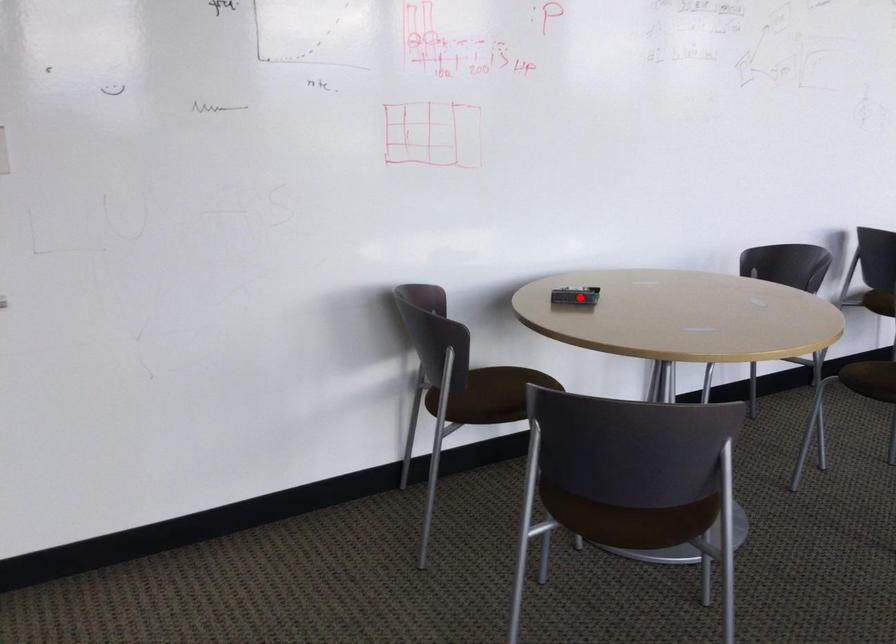
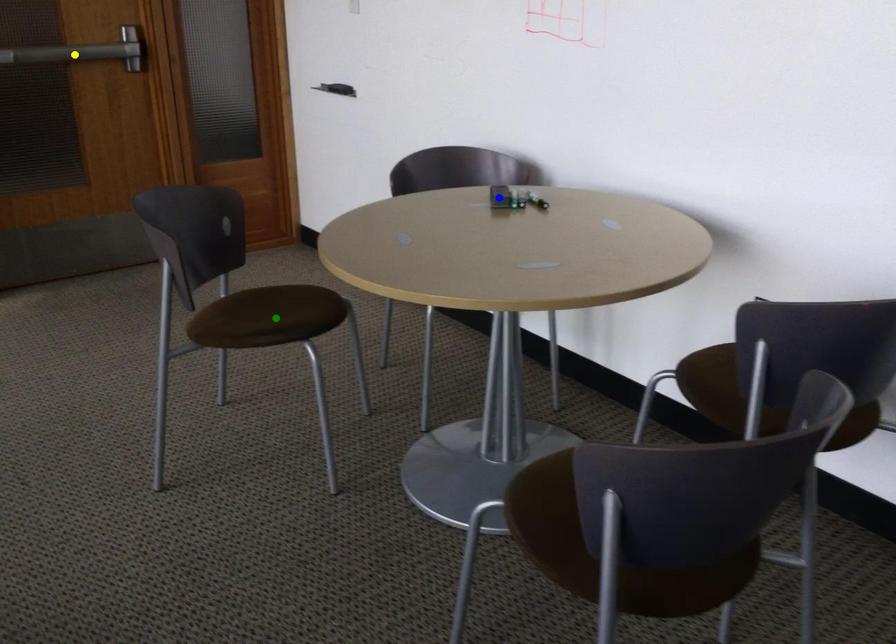
Question: I am providing you with two images of the same scene from different viewpoints. A red point is marked on the first image. You are given multiple points on the second image. Which spot in image 2 lines up with the point in image 1?

Choices:
 (A) green point
 (B) yellow point
 (C) blue point

Answer: (C)